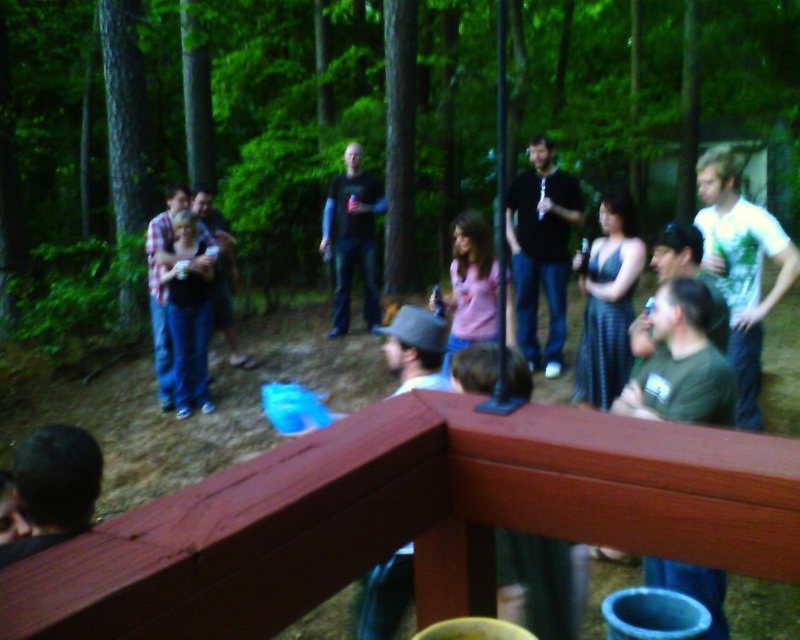
Can you confirm if black zip-up hoodie at center is taller than plaid shirt at left?

Correct, black zip-up hoodie at center is much taller as plaid shirt at left.

Which is more to the right, black zip-up hoodie at center or plaid shirt at left?

black zip-up hoodie at center

At what (x,y) coordinates should I click in order to perform the action: click on black zip-up hoodie at center. Please return your answer as a coordinate pair (x, y). Looking at the image, I should click on (541, 250).

Image resolution: width=800 pixels, height=640 pixels. In order to click on black zip-up hoodie at center in this screenshot , I will do `click(541, 250)`.

Who is positioned more to the left, dark brown hair at lower left or plaid shirt at left?

Positioned to the left is plaid shirt at left.

Can you confirm if dark brown hair at lower left is thinner than plaid shirt at left?

Yes, dark brown hair at lower left is thinner than plaid shirt at left.

Who is more distant from viewer, (26,445) or (165,195)?

Positioned behind is point (165,195).

Image resolution: width=800 pixels, height=640 pixels. Identify the location of dark brown hair at lower left. click(54, 486).

Does plaid shirt at left have a greater width compared to bearded man at center?

Incorrect, plaid shirt at left's width does not surpass bearded man at center's.

The height and width of the screenshot is (640, 800). Find the location of `plaid shirt at left`. plaid shirt at left is located at coordinates (162, 291).